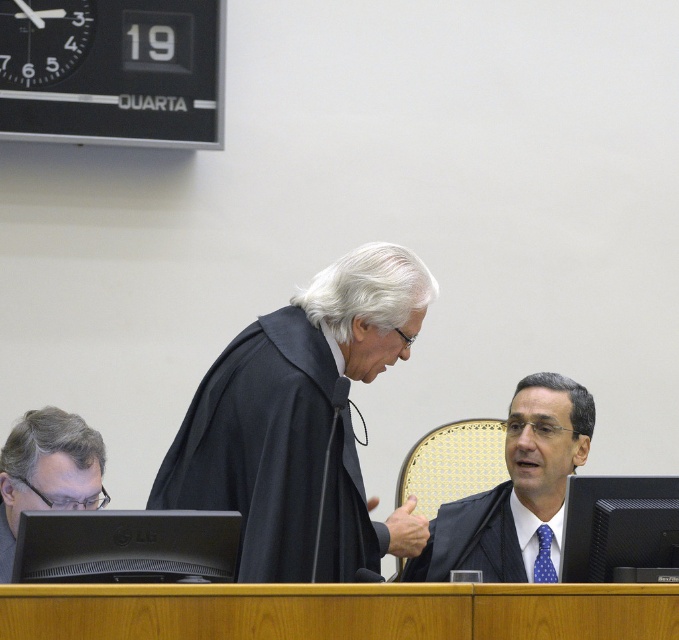
Question: Is black matte robe at center above dark blue textured robe at center?

Choices:
 (A) yes
 (B) no

Answer: (A)

Question: Does gray matte glasses at lower left have a lesser width compared to dark blue textured robe at center?

Choices:
 (A) no
 (B) yes

Answer: (B)

Question: Considering the relative positions of gray matte glasses at lower left and dark blue textured robe at center in the image provided, where is gray matte glasses at lower left located with respect to dark blue textured robe at center?

Choices:
 (A) left
 (B) right

Answer: (A)

Question: Which object is the closest to the black glossy suit at center?

Choices:
 (A) gray matte glasses at lower left
 (B) dark blue textured robe at center
 (C) black matte robe at center

Answer: (B)

Question: Which object is farther from the camera taking this photo?

Choices:
 (A) dark blue textured robe at center
 (B) gray matte glasses at lower left

Answer: (A)

Question: Which object appears closest to the camera in this image?

Choices:
 (A) black glossy suit at center
 (B) dark blue textured robe at center
 (C) gray matte glasses at lower left

Answer: (C)